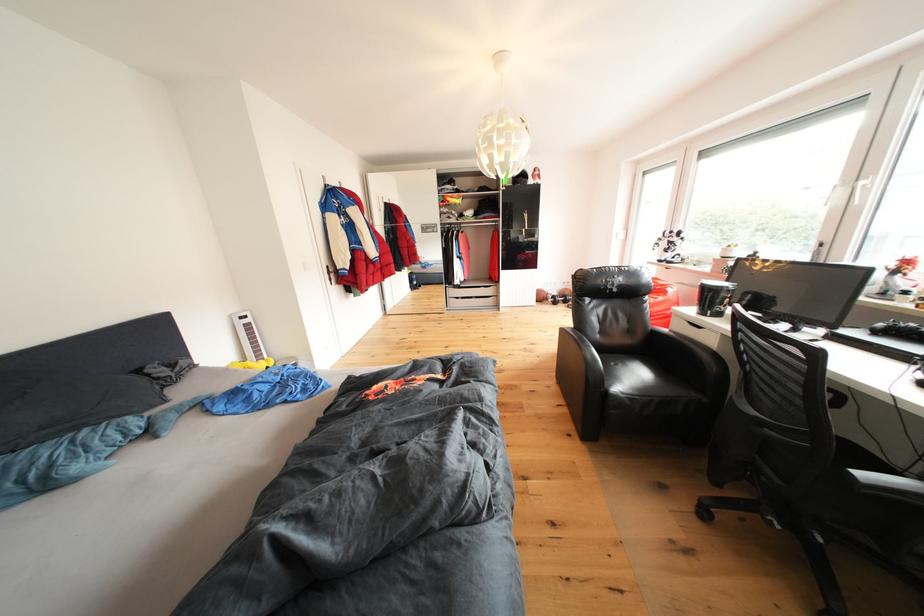
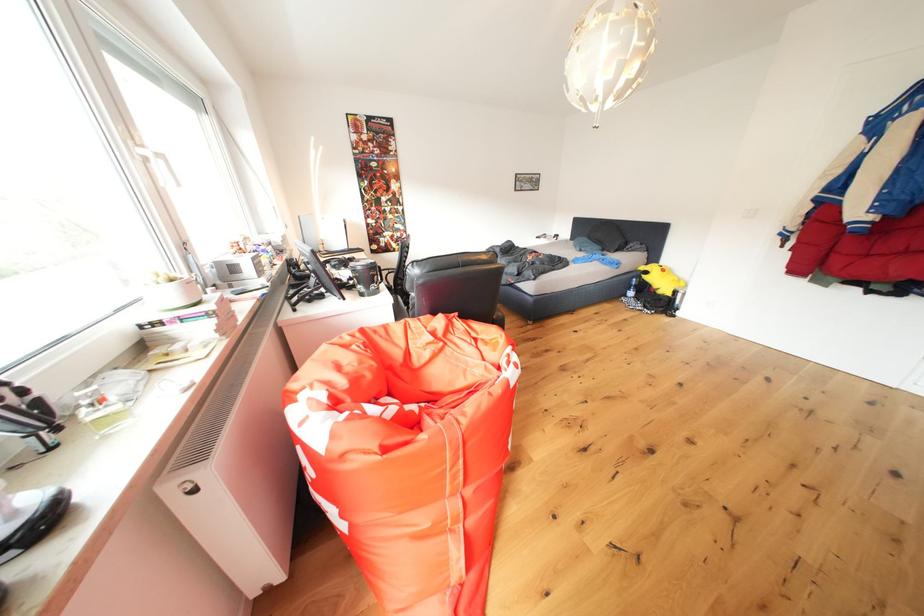
Question: I am providing you with two images of the same scene from different viewpoints. Which of the following objects are not visible in image2?

Choices:
 (A) black patterned mug
 (B) plastic water bottle
 (C) red umbrella
 (D) white window handle

Answer: (A)